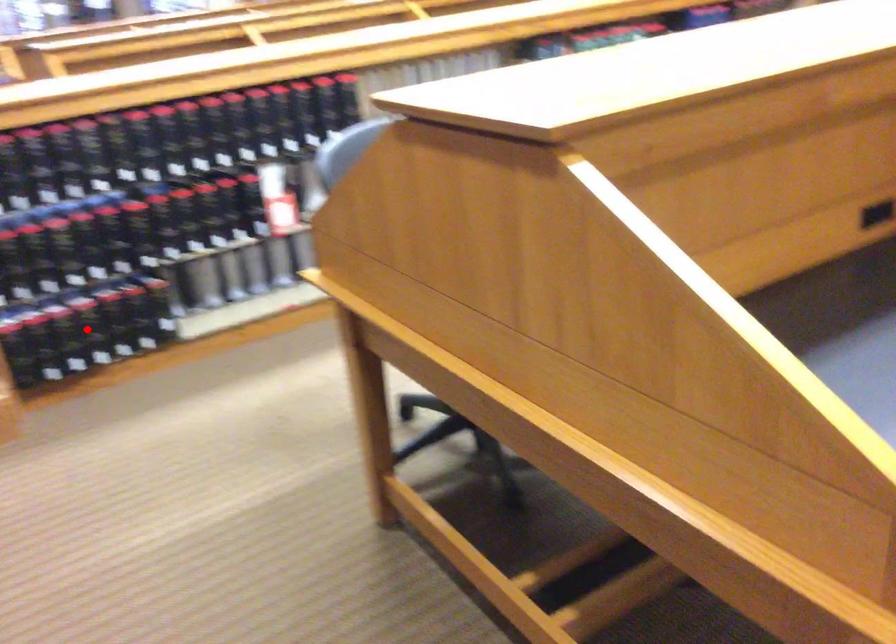
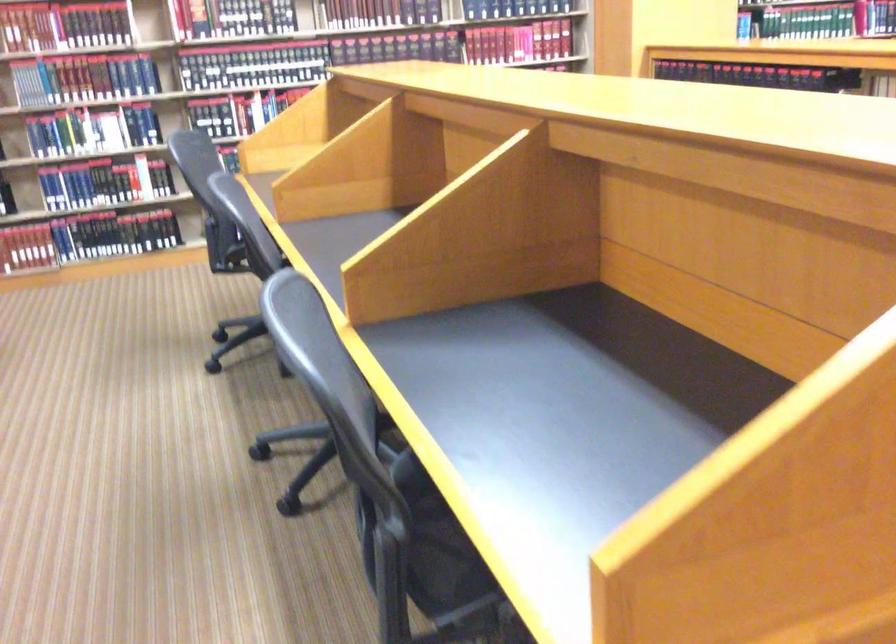
Question: I am providing you with two images of the same scene from different viewpoints. A red point is marked on the first image. Can you still see the location of the red point in image 2?

Choices:
 (A) Yes
 (B) No

Answer: (B)